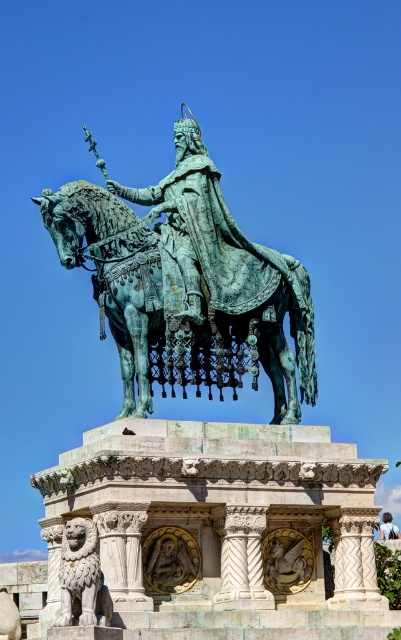
Does green patina horse at center come in front of stone lion at lower left?

No.

Can you confirm if green patina horse at center is smaller than stone lion at lower left?

No, green patina horse at center is not smaller than stone lion at lower left.

Is point (149, 243) more distant than point (70, 552)?

Yes, it is behind point (70, 552).

Where is `green patina horse at center`? green patina horse at center is located at coordinates (178, 320).

Which of these two, green patina horse at center or blue fabric at upper center, stands taller?

With more height is green patina horse at center.

Which is above, green patina horse at center or blue fabric at upper center?

green patina horse at center is above.

Is point (176, 333) less distant than point (380, 529)?

Yes, point (176, 333) is in front of point (380, 529).

You are a GUI agent. You are given a task and a screenshot of the screen. Output one action in this format:
    pyautogui.click(x=<x>, y=<y>)
    Task: Click on the green patina horse at center
    The width and height of the screenshot is (401, 640).
    Given the screenshot: What is the action you would take?
    pyautogui.click(x=178, y=320)

Does point (101, 596) come closer to viewer compared to point (392, 532)?

That is True.

Is stone lion at lower left further to the viewer compared to blue fabric at upper center?

No, it is not.

Is point (70, 550) farther from viewer compared to point (388, 525)?

No, (70, 550) is closer to viewer.

This screenshot has width=401, height=640. I want to click on stone lion at lower left, so click(81, 577).